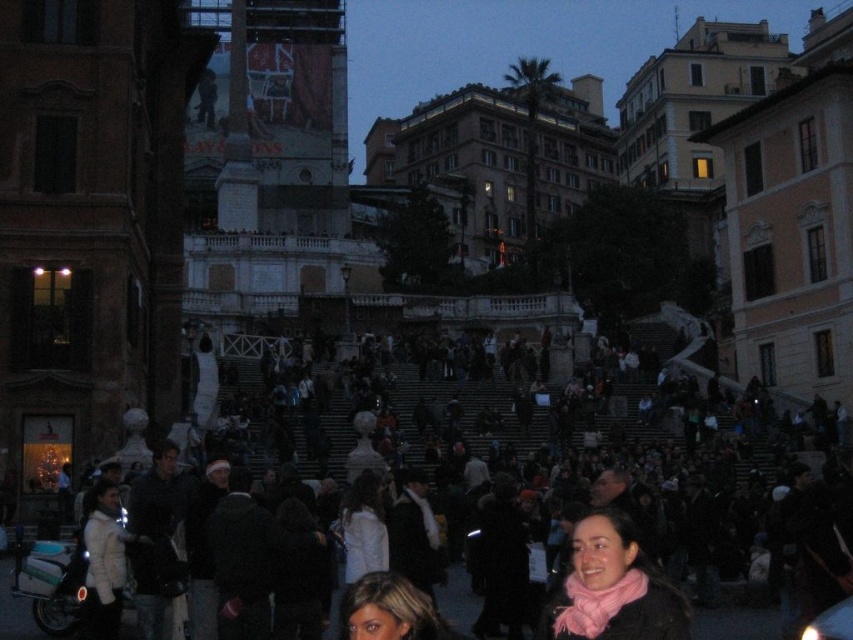
Between dark clothing crowd at center and pink scarf at lower center, which one has less height?

pink scarf at lower center is shorter.

Which is above, dark clothing crowd at center or pink scarf at lower center?

dark clothing crowd at center

Identify the location of dark clothing crowd at center. This screenshot has width=853, height=640. (601, 465).

Does pink scarf at lower center have a smaller size compared to blonde hair at center?

No.

Does pink scarf at lower center appear on the left side of blonde hair at center?

In fact, pink scarf at lower center is to the right of blonde hair at center.

Who is more forward, (x=604, y=508) or (x=428, y=632)?

Point (x=428, y=632)

Locate an element on the screen. pink scarf at lower center is located at coordinates (612, 588).

Does dark clothing crowd at center come in front of blonde hair at center?

No, it is behind blonde hair at center.

Can you confirm if dark clothing crowd at center is positioned to the right of blonde hair at center?

Yes, dark clothing crowd at center is to the right of blonde hair at center.

Is point (427, 461) behind point (428, 598)?

Yes, it is.

Where is `dark clothing crowd at center`? dark clothing crowd at center is located at coordinates coord(601,465).